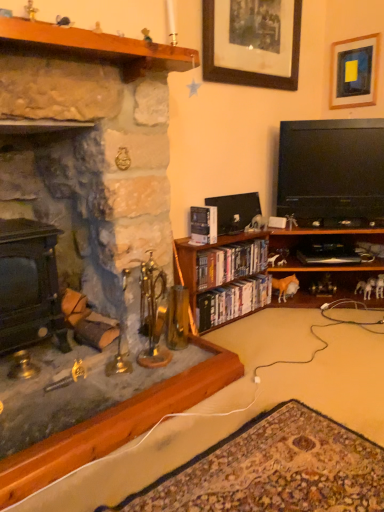
Locate an element on the screen. vacant space to the right of hardcover books at center, arranged as the first book when ordered from the bottom is located at coordinates (289, 327).